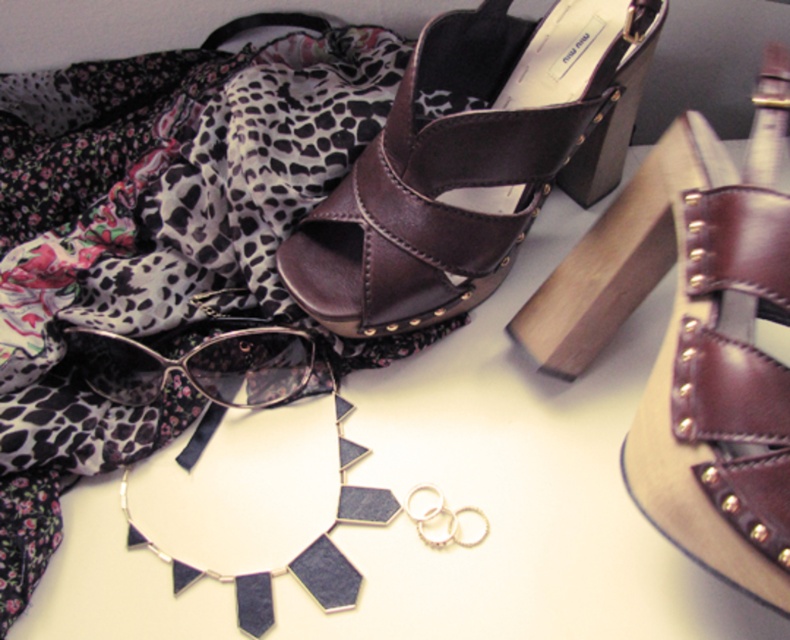
You are standing at a distance and looking at the point marked as point (311, 216). Can you reach it without moving closer?

The distance between you and point (311, 216) is 30.79 inches. Since this distance is greater than the typical reaching distance of about 24 inches, you cannot reach it without moving closer.

You are arranging fashion accessories on a table and see the brown leather sandal at center and the matte black sunglasses at center. Which accessory is located to the right of the other?

The brown leather sandal at center is positioned on the right side of matte black sunglasses at center.

You are a photographer setting up a shoot for a fashion magazine. You need to position the brown leather sandal at center so that it is exactly 30 inches away from the camera lens. Currently, the sandal is positioned at its current distance. How should you adjust its position to meet the requirement?

The brown leather sandal at center is currently 25.58 inches away from the viewer. To reach the desired 30 inches, move it backward by approximately 4.42 inches.